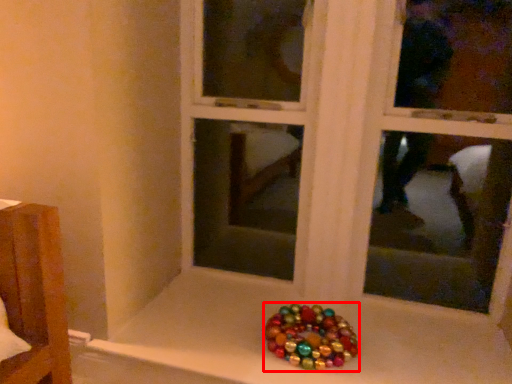
Question: From the image's perspective, where is glass bead (annotated by the red box) located relative to bay window?

Choices:
 (A) below
 (B) above

Answer: (A)